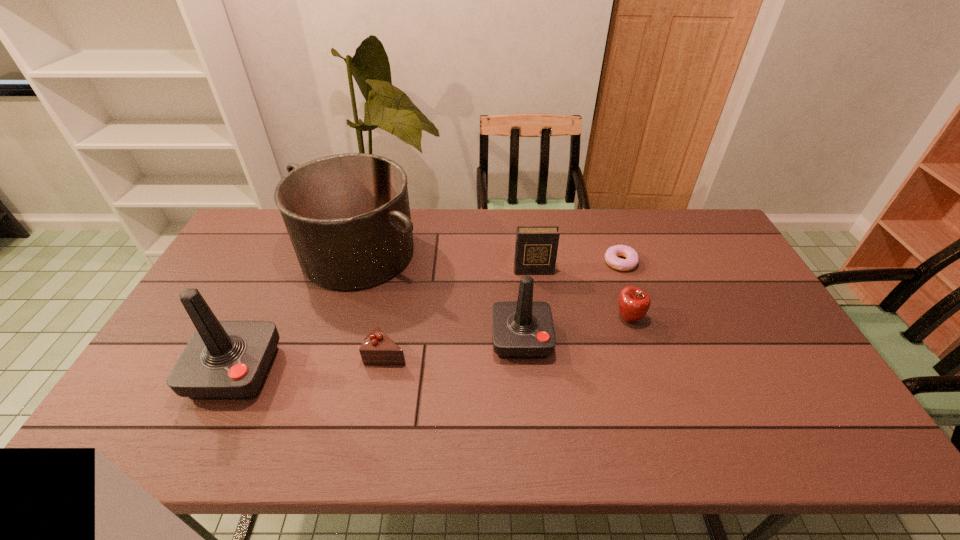
Please point out where to position a new joystick on the right to maintain spacing. Please provide its 2D coordinates. Your answer should be formatted as a tuple, i.e. [(x, y)], where the tuple contains the x and y coordinates of a point satisfying the conditions above.

[(773, 310)]